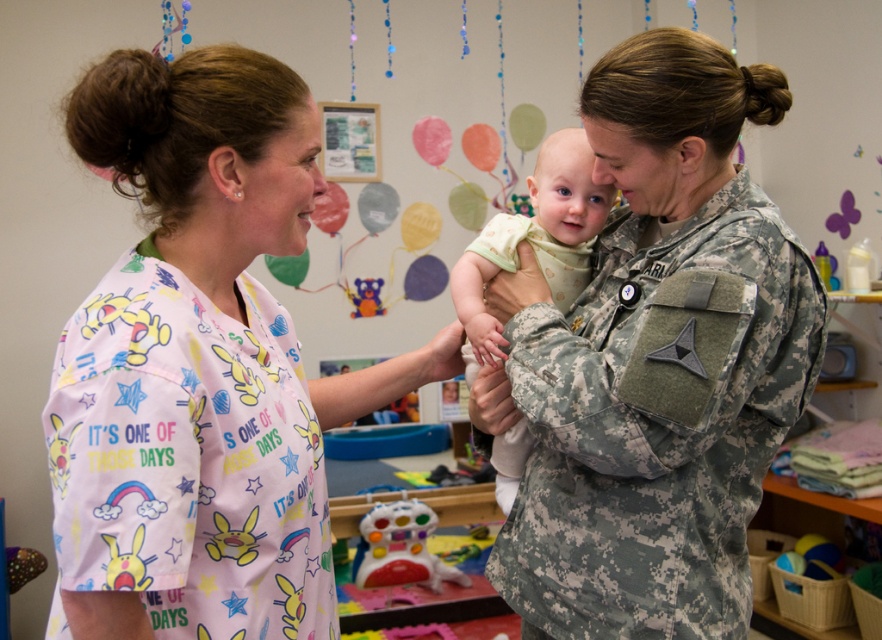
You are a child trying to decide between the camouflage fabric uniform at center and the multicolored plastic toy at center. Which one is larger?

The camouflage fabric uniform at center is bigger than the multicolored plastic toy at center.

You are a photographer setting up a shot of the pink fabric shirt at left and the light green fabric baby at center. From your current position, which object is closer to the camera?

The pink fabric shirt at left is positioned under the light green fabric baby at center, so the light green fabric baby at center is closer to the camera.